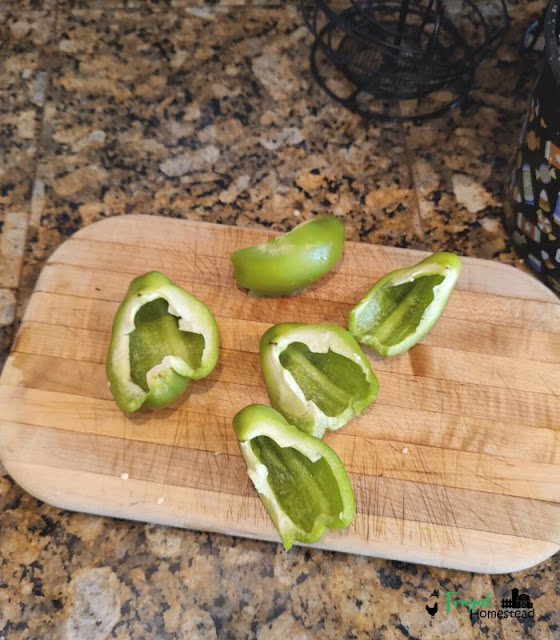
Identify the location of blackcandy container. pyautogui.click(x=536, y=156).